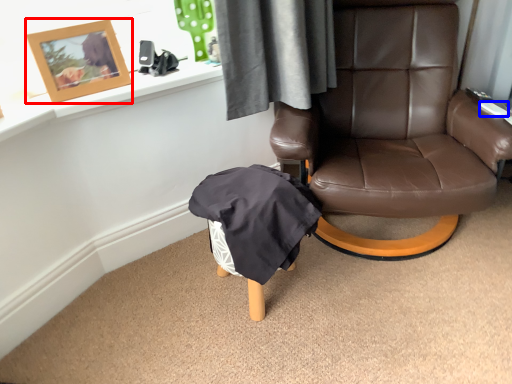
Question: Which object is further to the camera taking this photo, picture frame (highlighted by a red box) or remote control (highlighted by a blue box)?

Choices:
 (A) picture frame
 (B) remote control

Answer: (B)